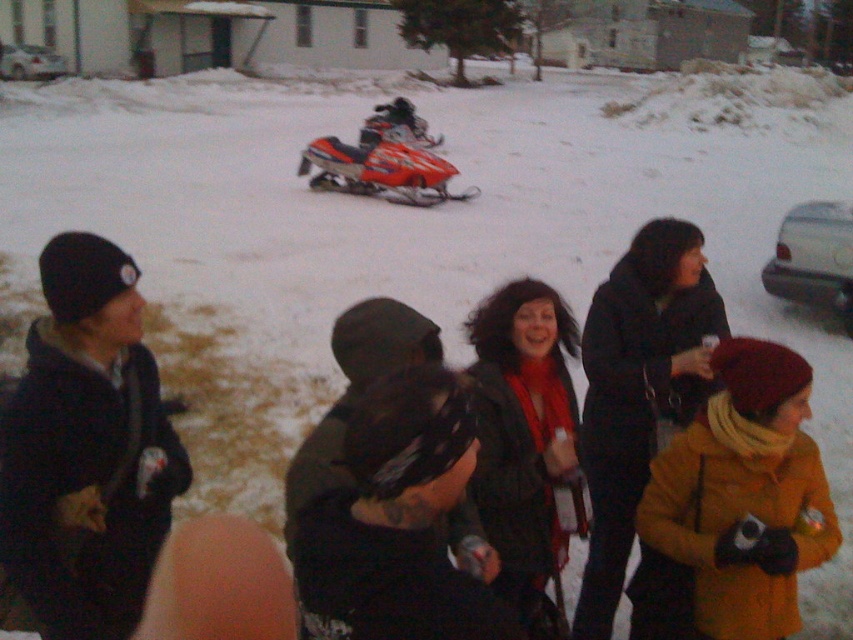
In the scene shown: You are a fashion designer observing winter clothing in the scene. Which of the two coats, the black matte jacket at center or the dark gray coat at center, is shorter in height?

The black matte jacket at center is shorter in height compared to the dark gray coat at center.